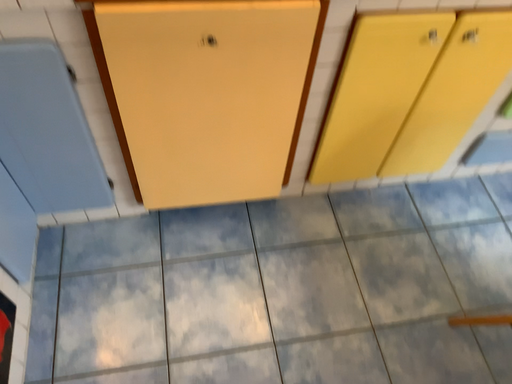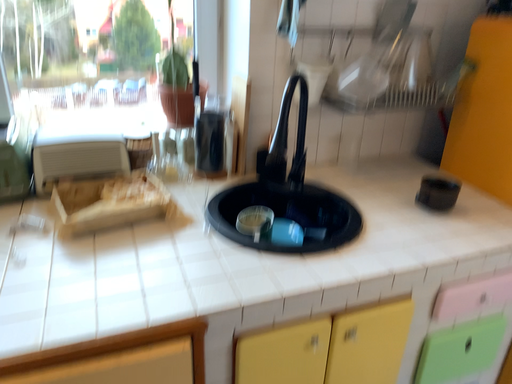
Question: Which way did the camera rotate in the video?

Choices:
 (A) rotated upward
 (B) rotated downward

Answer: (A)